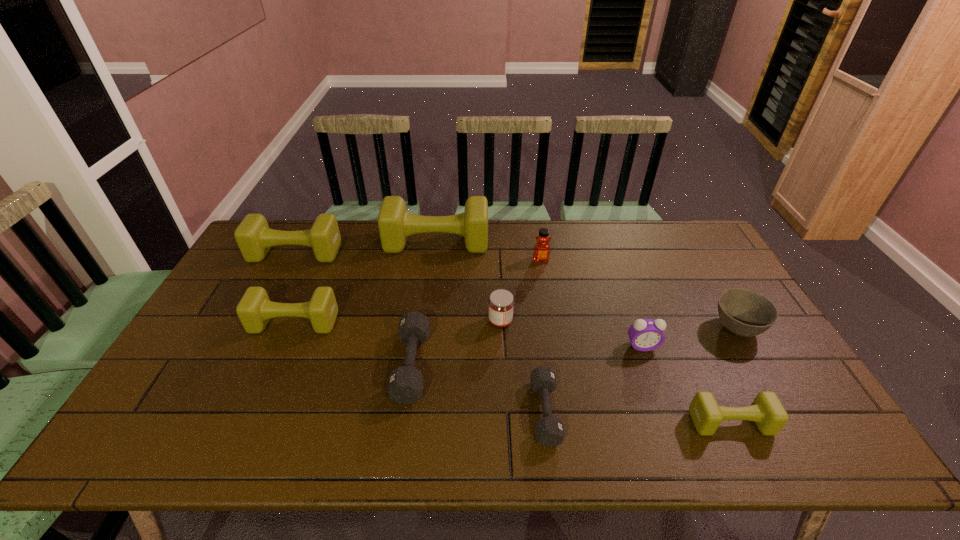
This screenshot has width=960, height=540. Find the location of `unoccupied area between the honey and the bowl`. unoccupied area between the honey and the bowl is located at coordinates (638, 294).

Where is `free area in between the tallest object and the jam`? free area in between the tallest object and the jam is located at coordinates (468, 282).

Where is `free space between the fifth shortest dumbbell and the bigger gray dumbbell`? Image resolution: width=960 pixels, height=540 pixels. free space between the fifth shortest dumbbell and the bigger gray dumbbell is located at coordinates (353, 309).

Where is `empty location between the bigger gray dumbbell and the jam`? The image size is (960, 540). empty location between the bigger gray dumbbell and the jam is located at coordinates (456, 343).

Locate an element on the screen. The height and width of the screenshot is (540, 960). empty location between the second nearest olive dumbbell and the jam is located at coordinates (397, 322).

Image resolution: width=960 pixels, height=540 pixels. I want to click on object that is the nearest to the third smallest olive dumbbell, so click(395, 224).

This screenshot has width=960, height=540. I want to click on the fourth closest object to the second biggest olive dumbbell, so click(x=501, y=303).

Locate an element on the screen. dumbbell that is the third closest one to the bigger gray dumbbell is located at coordinates (395, 224).

At what (x,y) coordinates should I click in order to perform the action: click on dumbbell that is the fourth closest one to the alarm clock. Please return your answer as a coordinate pair (x, y). The width and height of the screenshot is (960, 540). Looking at the image, I should click on (405, 384).

Locate which olive dumbbell is the fourth closest to the fifth dumbbell from left to right. Please provide its 2D coordinates. Your answer should be formatted as a tuple, i.e. [(x, y)], where the tuple contains the x and y coordinates of a point satisfying the conditions above.

[(254, 237)]